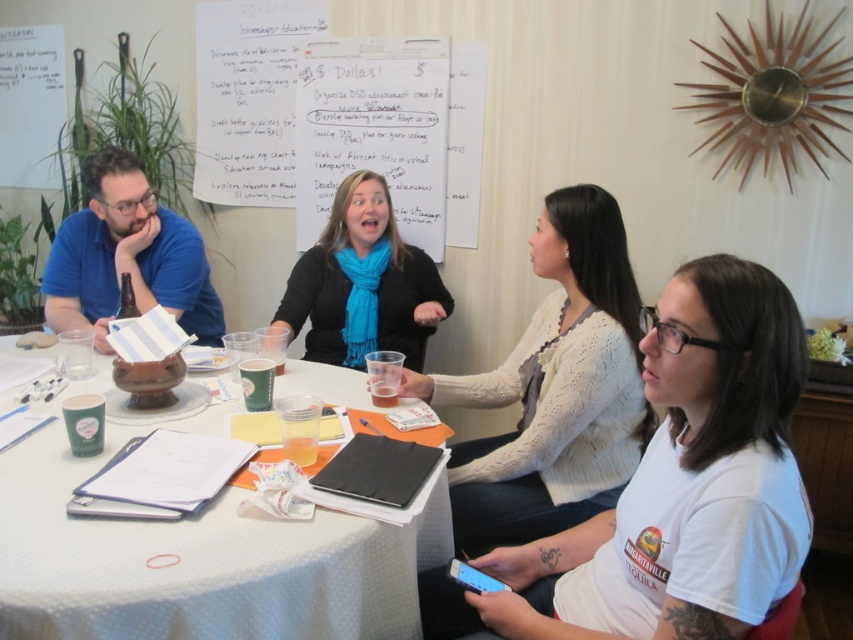
You are sitting at the table and want to reach both the point at coordinates point (519, 586) and point (78, 552). Which point is closer to you?

Point (78, 552) is closer to you because it is in front of point (519, 586).

What is the location of the point with coordinates (688, 481) in relation to the objects in the scene?

The point with coordinates (688, 481) is located on the white cotton shirt at lower right.